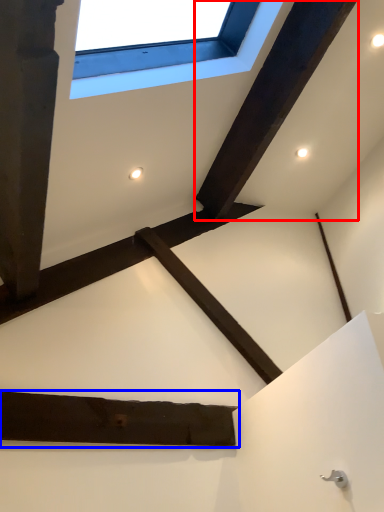
Question: Which of the following is the closest to the observer, plank (highlighted by a red box) or plank (highlighted by a blue box)?

Choices:
 (A) plank
 (B) plank

Answer: (B)